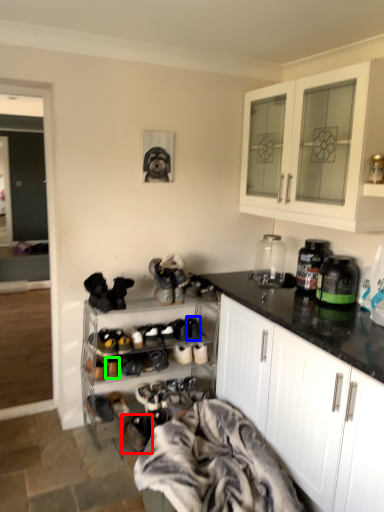
Question: Considering the real-world distances, which object is closest to footwear (highlighted by a red box)? shoe (highlighted by a blue box) or shoe (highlighted by a green box).

Choices:
 (A) shoe
 (B) shoe

Answer: (B)